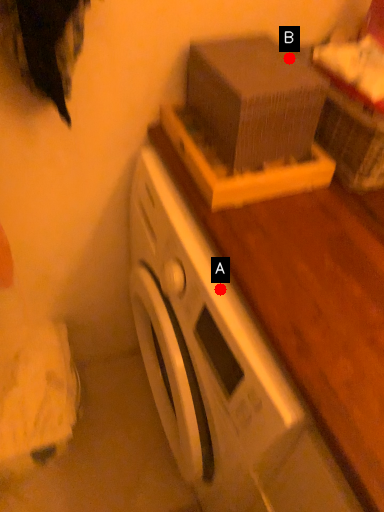
Question: Two points are circled on the image, labeled by A and B beside each circle. Which of the following is the closest to the observer?

Choices:
 (A) A is closer
 (B) B is closer

Answer: (A)